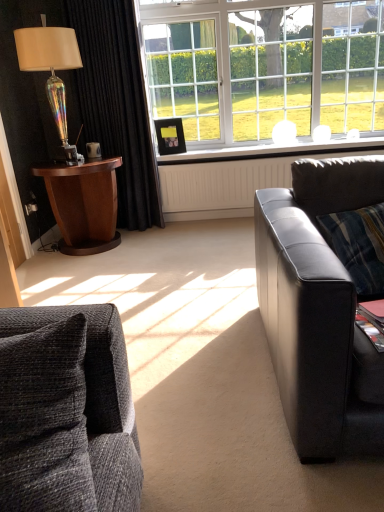
Question: Does white plastic window sill at center lie behind black velvet curtain at left?

Choices:
 (A) yes
 (B) no

Answer: (A)

Question: From the image's perspective, is white plastic window sill at center located beneath black velvet curtain at left?

Choices:
 (A) yes
 (B) no

Answer: (A)

Question: Is white plastic window sill at center shorter than black velvet curtain at left?

Choices:
 (A) yes
 (B) no

Answer: (A)

Question: Is white plastic window sill at center facing towards black velvet curtain at left?

Choices:
 (A) no
 (B) yes

Answer: (A)

Question: Is white plastic window sill at center at the left side of black velvet curtain at left?

Choices:
 (A) yes
 (B) no

Answer: (B)

Question: Considering their positions, is iridescent glass lamp at left located in front of or behind black plastic power outlet at lower left?

Choices:
 (A) behind
 (B) front

Answer: (B)

Question: Considering the relative positions of iridescent glass lamp at left and black plastic power outlet at lower left in the image provided, is iridescent glass lamp at left to the left or to the right of black plastic power outlet at lower left?

Choices:
 (A) right
 (B) left

Answer: (A)

Question: Considering the positions of iridescent glass lamp at left and black plastic power outlet at lower left in the image, is iridescent glass lamp at left taller or shorter than black plastic power outlet at lower left?

Choices:
 (A) short
 (B) tall

Answer: (B)

Question: Considering the positions of point (31, 53) and point (29, 200), is point (31, 53) closer or farther from the camera than point (29, 200)?

Choices:
 (A) farther
 (B) closer

Answer: (B)

Question: From a real-world perspective, is textured gray couch at lower left, which is counted as the 1th studio couch, starting from the left, physically located above or below white plastic window sill at center?

Choices:
 (A) below
 (B) above

Answer: (A)

Question: From the image's perspective, is textured gray couch at lower left, marked as the first studio couch in a front-to-back arrangement, above or below white plastic window sill at center?

Choices:
 (A) above
 (B) below

Answer: (B)

Question: In the image, is textured gray couch at lower left, positioned as the second studio couch in right-to-left order, positioned in front of or behind white plastic window sill at center?

Choices:
 (A) behind
 (B) front

Answer: (B)

Question: Is textured gray couch at lower left, which is counted as the 1th studio couch, starting from the left, bigger or smaller than white plastic window sill at center?

Choices:
 (A) big
 (B) small

Answer: (A)

Question: Is black leather couch at right, which is counted as the second studio couch, starting from the front, in front of or behind wooden side table at left in the image?

Choices:
 (A) front
 (B) behind

Answer: (A)

Question: In terms of size, does black leather couch at right, which appears as the second studio couch when viewed from the left, appear bigger or smaller than wooden side table at left?

Choices:
 (A) small
 (B) big

Answer: (B)